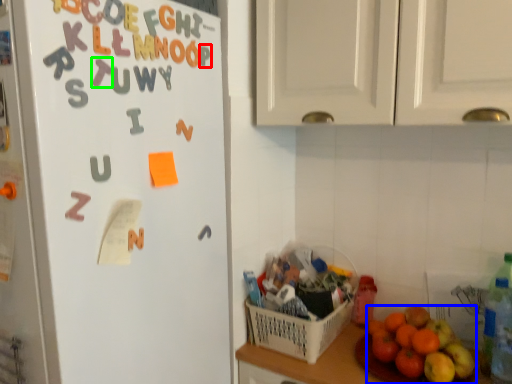
Question: Based on their relative distances, which object is farther from letter (highlighted by a red box)? Choose from grapefruit (highlighted by a blue box) and alphabet (highlighted by a green box).

Choices:
 (A) grapefruit
 (B) alphabet

Answer: (A)